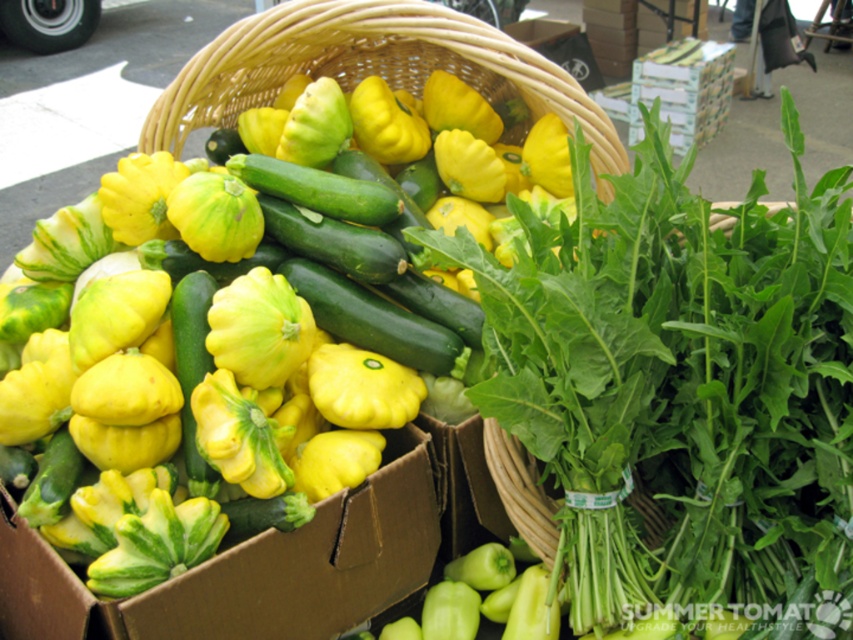
You are a chef preparing a vegetable platter and need to choose between the green smooth zucchini at center and the green matte cucumber at center based on size. Which one is smaller?

The green smooth zucchini at center is smaller than the green matte cucumber at center, so you should choose the green smooth zucchini at center for the vegetable platter if a smaller size is needed.

You are standing in front of the market stall and want to grab the green matte cucumber at center. However, the green smooth zucchini at center is blocking your view. Can you reach the cucumber without moving the zucchini?

The green matte cucumber at center is behind green smooth zucchini at center, so you can reach it by moving your hand around the sides of the green smooth zucchini at center to access the cucumber behind it.